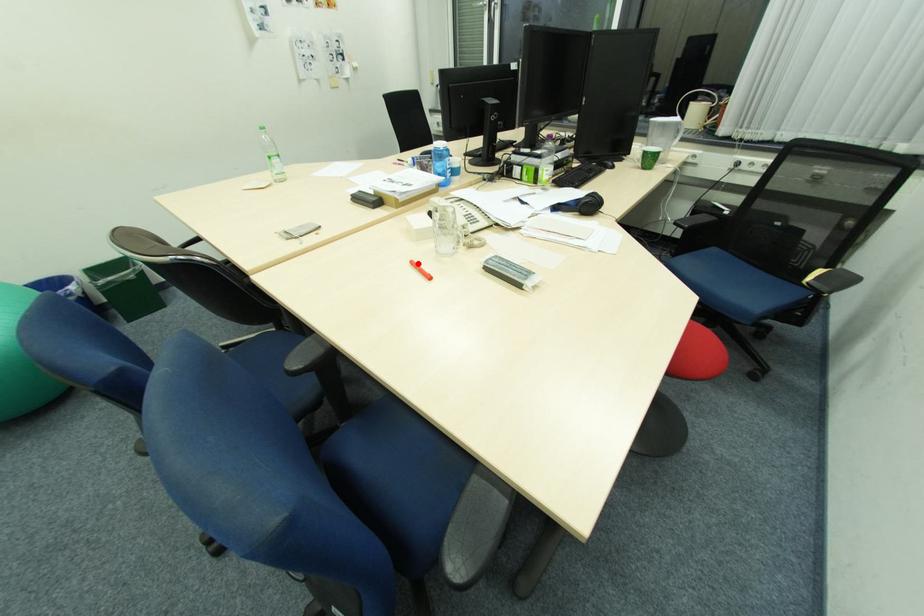
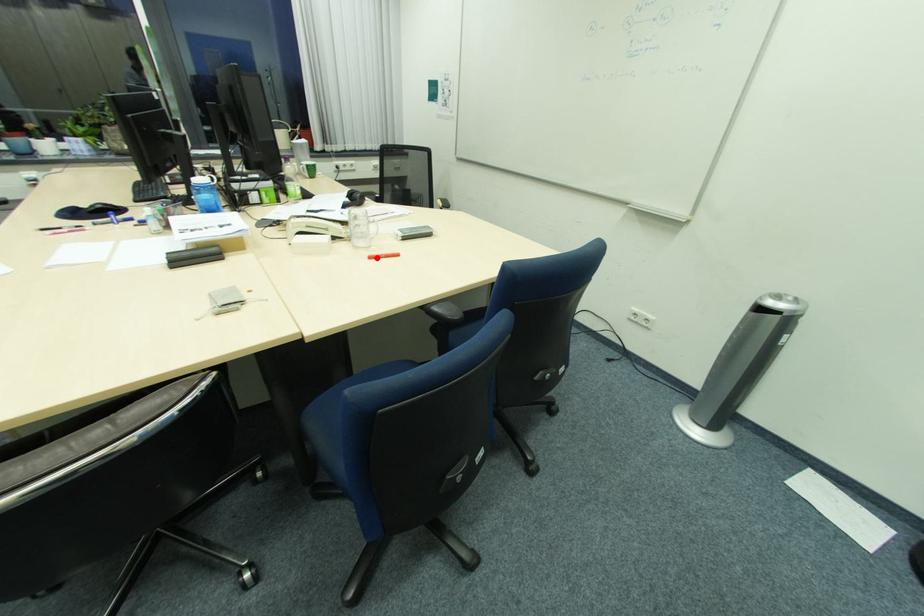
I am providing you with two images of the same scene from different viewpoints. A red point is marked on the first image and another point is marked on the second image. Do the highlighted points in image1 and image2 indicate the same real-world spot?

Yes